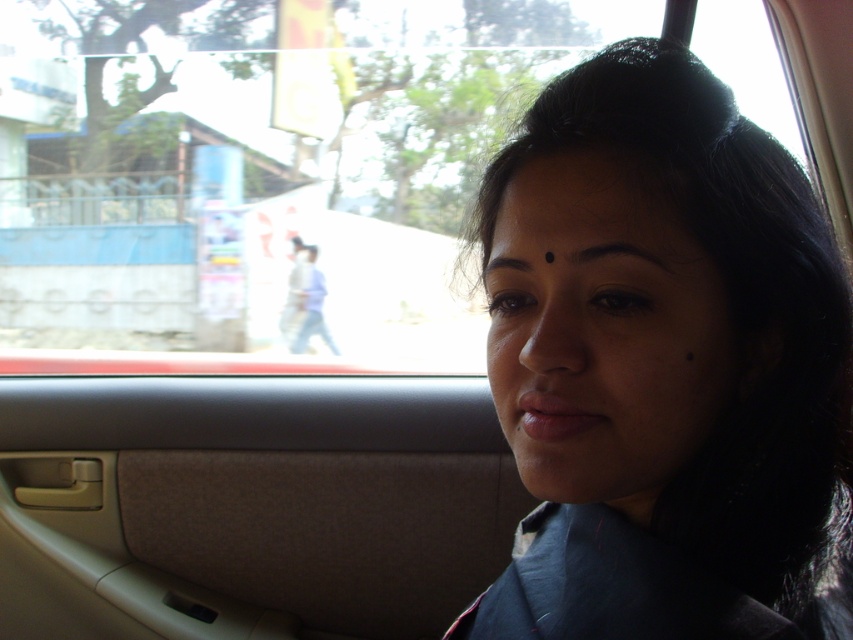
Question: From the image, what is the correct spatial relationship of dark blue fabric at center in relation to black smooth forehead at upper center?

Choices:
 (A) right
 (B) left

Answer: (A)

Question: Among these objects, which one is nearest to the camera?

Choices:
 (A) dark blue fabric at center
 (B) black smooth forehead at upper center

Answer: (A)

Question: Does dark blue fabric at center have a smaller size compared to black smooth forehead at upper center?

Choices:
 (A) yes
 (B) no

Answer: (B)

Question: Which object is closer to the camera taking this photo?

Choices:
 (A) dark blue fabric at center
 (B) black smooth forehead at upper center

Answer: (A)

Question: Is dark blue fabric at center closer to the viewer compared to black smooth forehead at upper center?

Choices:
 (A) yes
 (B) no

Answer: (A)